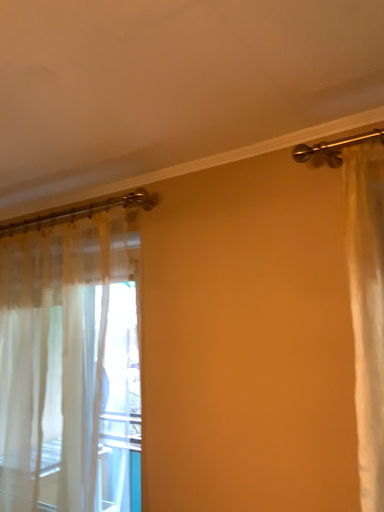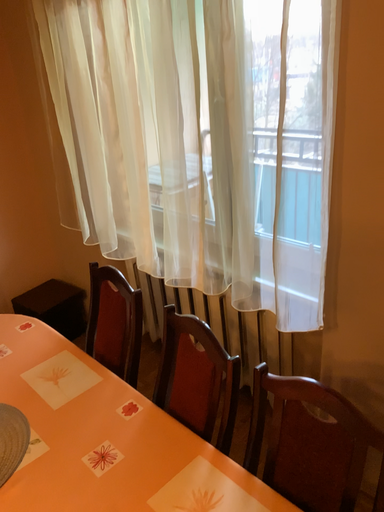
Question: Which way did the camera rotate in the video?

Choices:
 (A) rotated upward
 (B) rotated downward

Answer: (B)